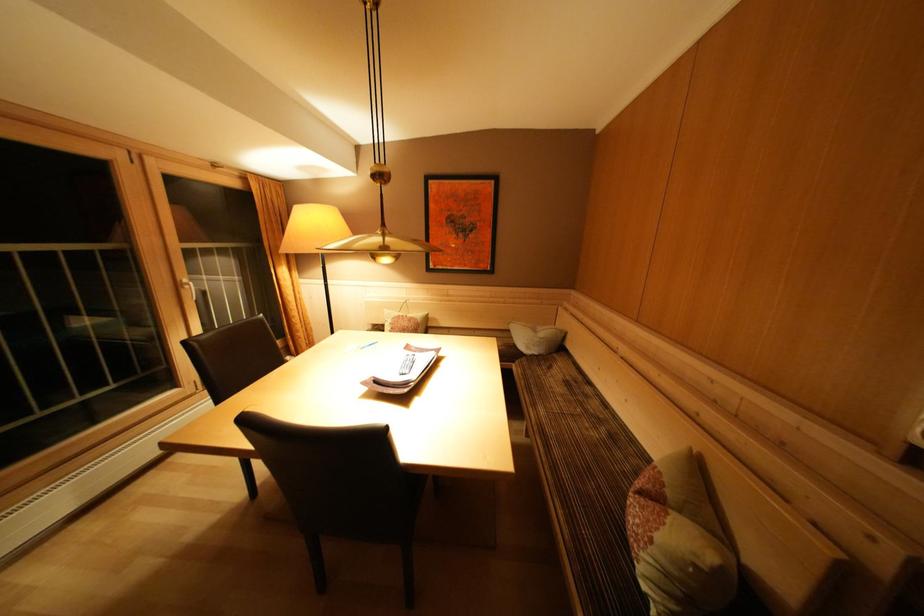
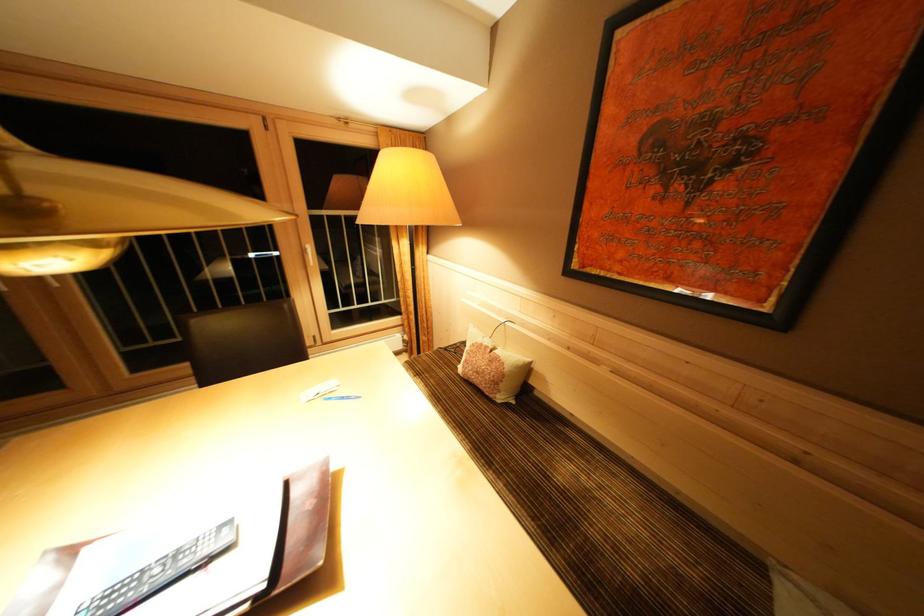
The point at (x=409, y=321) is marked in the first image. Where is the corresponding point in the second image?

(493, 352)